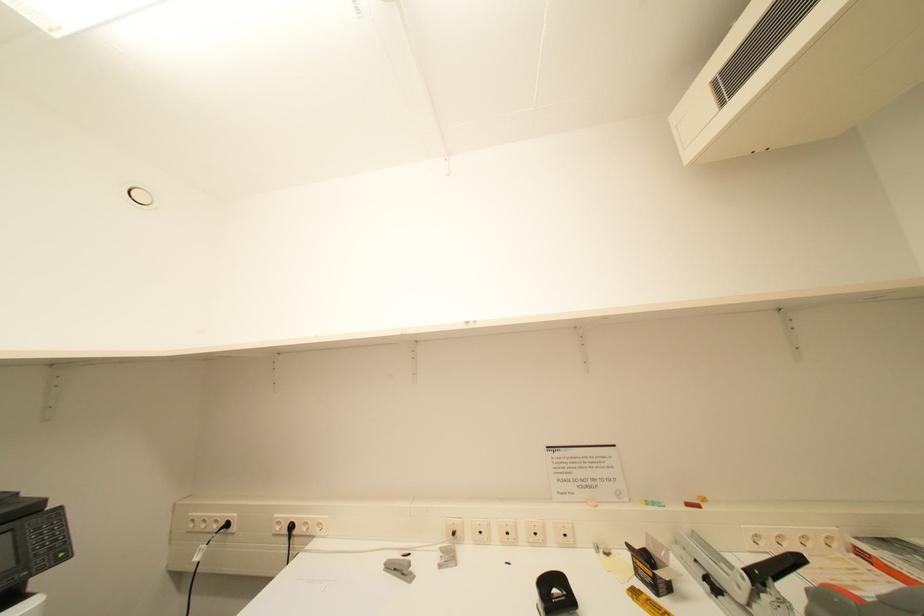
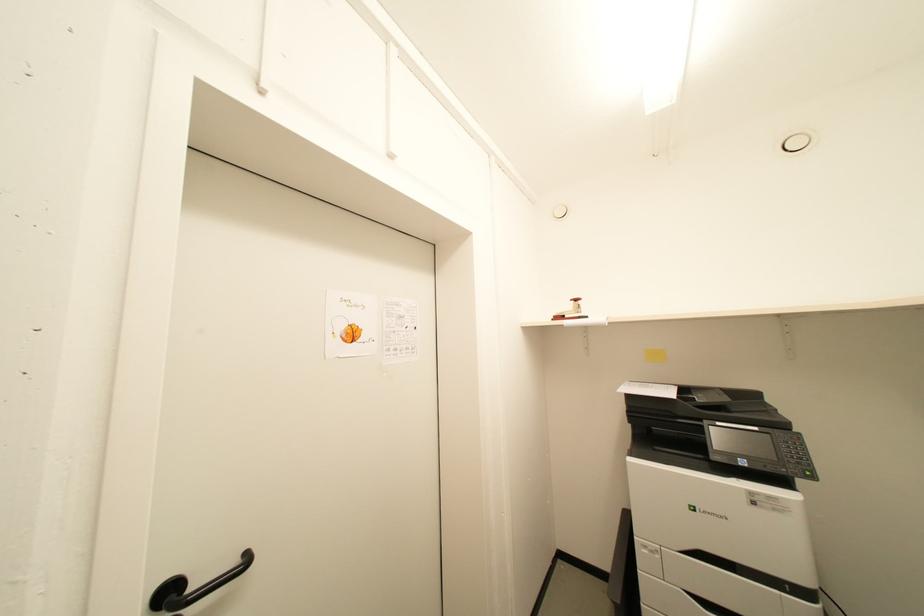
Question: Based on the continuous images, in which direction is the camera rotating? Reply with the corresponding letter.

Choices:
 (A) Left
 (B) Right
 (C) Up
 (D) Down

Answer: (A)